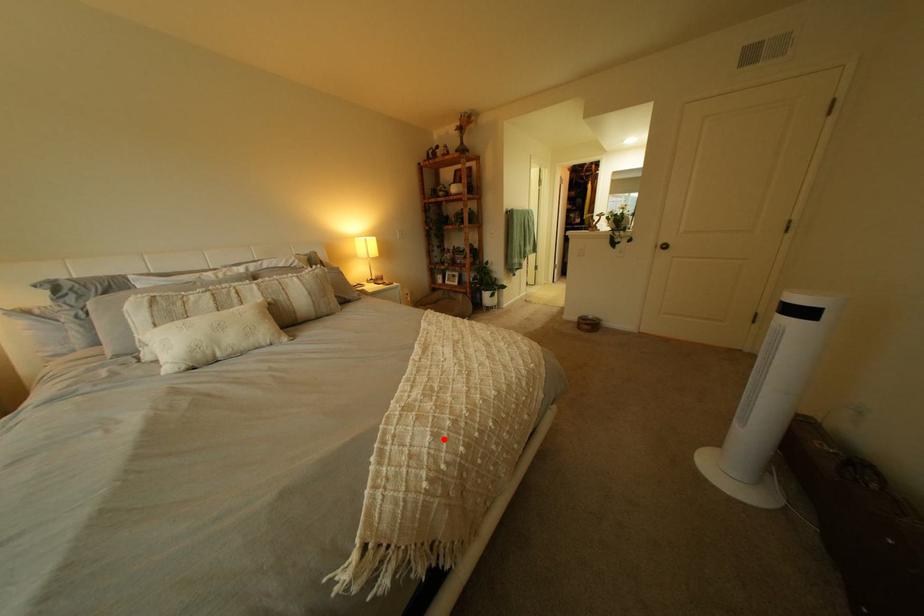
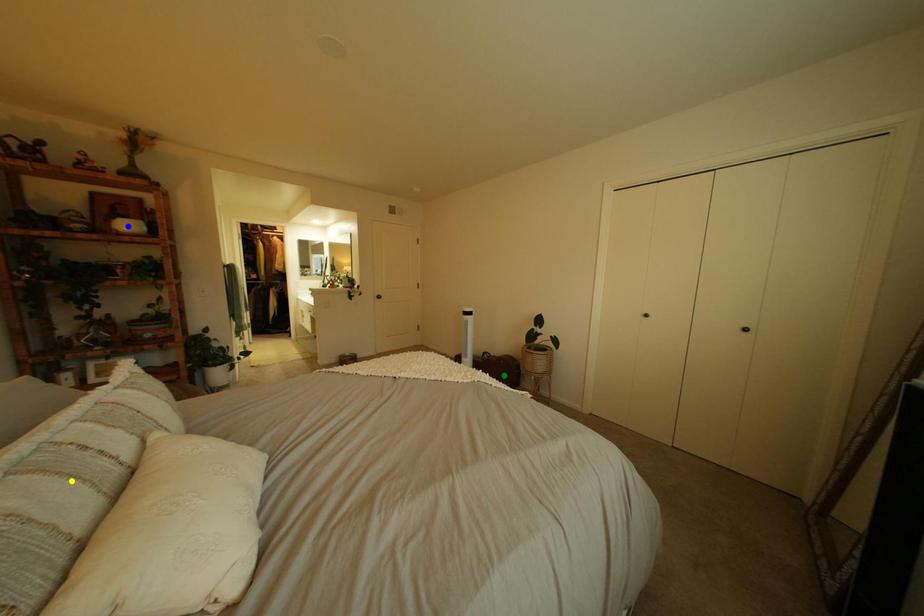
Question: I am providing you with two images of the same scene from different viewpoints. A red point is marked on the first image. You are given multiple points on the second image. Which point in image 2 represents the same 3d spot as the red point in image 1?

Choices:
 (A) blue point
 (B) yellow point
 (C) green point

Answer: (C)